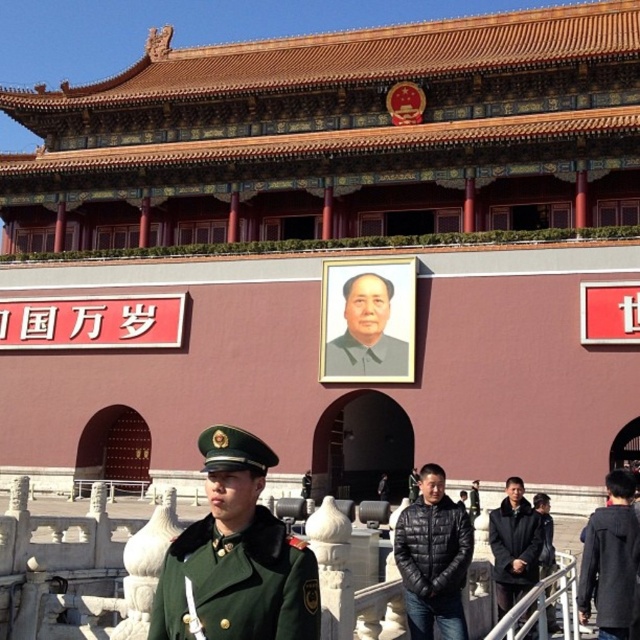
You are standing in front of the Gate of Heavenly Peace and notice a guard wearing a green fabric uniform at lower right. Where is the guard positioned relative to the Mao Zedong portrait?

The green fabric uniform at lower right is located at point (609, 568), which is to the right and slightly below the Mao Zedong portrait on the gate.

You are a tourist standing at the base of the Gate of Heavenly Peace. You want to take a photo of the smooth gray portrait at center while also capturing the green fabric uniform at lower right in the frame. Given that your camera has a maximum focal length that allows capturing objects within 50 feet of each other, will you be able to include both in a single photo?

The distance between the green fabric uniform at lower right and the smooth gray portrait at center is 86.53 feet, which exceeds the camera maximum focal length of 50 feet. Therefore, you cannot capture both in a single photo.

You are standing at the base of Tiananmen Gate and want to take a photo of the Mao Zedong portrait. You have a green woolen coat at lower left and a camera. How far apart are these two items?

The green woolen coat at lower left and camera are 13.18 meters apart.